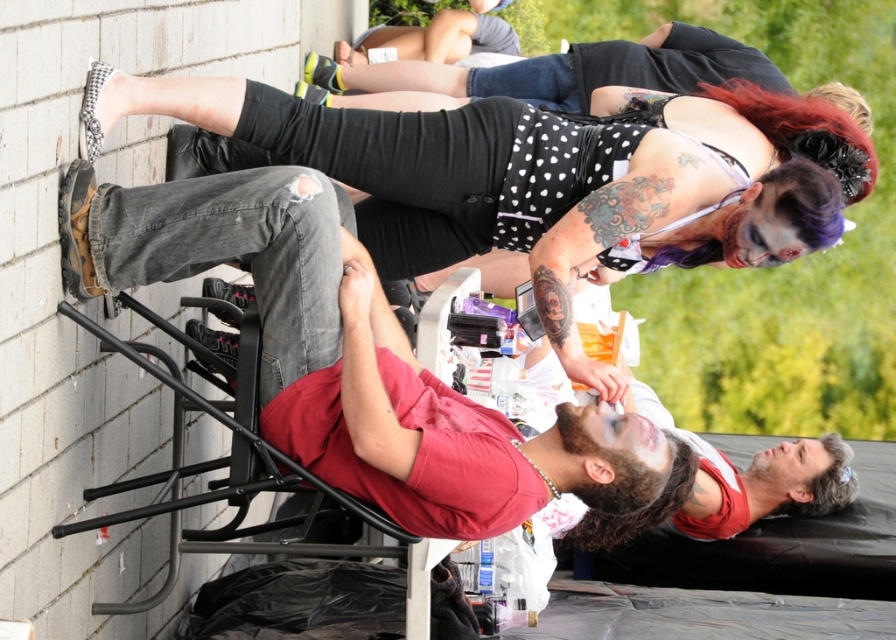
In the scene shown: You are at a zombie convention and need to locate two participants. The first participant is wearing a matte red shirt at center, and the second is wearing a polka dot fabric dress at upper center. According to the scene, which participant is positioned to the right of the other?

The polka dot fabric dress at upper center is to the right of the matte red shirt at center.

You are a photographer at a zombie convention. You need to position a camera to capture both the polka dot fabric dress at upper center and the matte red shirt at center. Which object should you focus on first to ensure both are in frame?

The polka dot fabric dress at upper center is above the matte red shirt at center, so focus on the polka dot fabric dress at upper center first to ensure both are in frame.